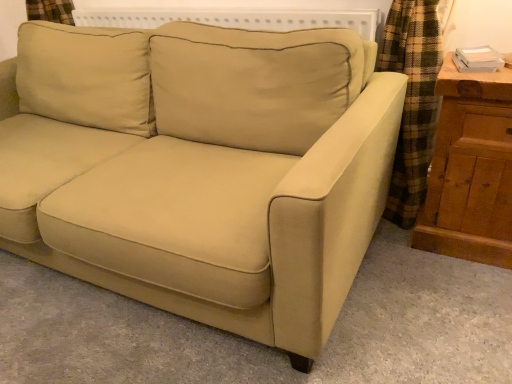
Image resolution: width=512 pixels, height=384 pixels. Find the location of `vacant space that is to the left of wooden dresser at right`. vacant space that is to the left of wooden dresser at right is located at coordinates (392, 254).